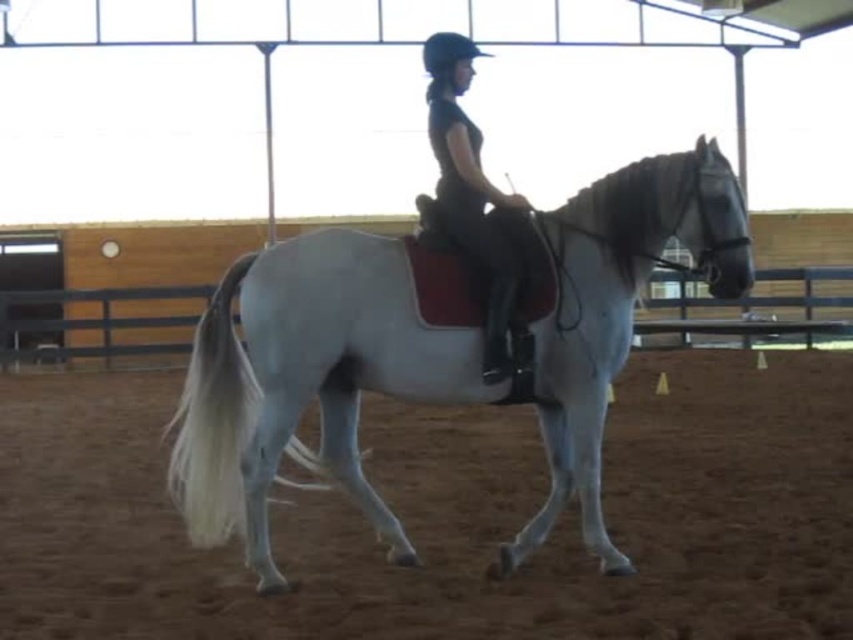
Question: Where is white glossy horse at center located in relation to black leather pants at center in the image?

Choices:
 (A) right
 (B) left

Answer: (B)

Question: Which object is the closest to the white glossy horse at center?

Choices:
 (A) brown dirt track at center
 (B) black leather pants at center

Answer: (B)

Question: Which point appears closest to the camera in this image?

Choices:
 (A) (453, 100)
 (B) (373, 406)

Answer: (A)

Question: Can you confirm if white glossy horse at center is positioned below black leather pants at center?

Choices:
 (A) no
 (B) yes

Answer: (B)

Question: Does white glossy horse at center have a larger size compared to black leather pants at center?

Choices:
 (A) yes
 (B) no

Answer: (A)

Question: Among these points, which one is nearest to the camera?

Choices:
 (A) (425, 42)
 (B) (793, 362)
 (C) (302, 304)

Answer: (C)